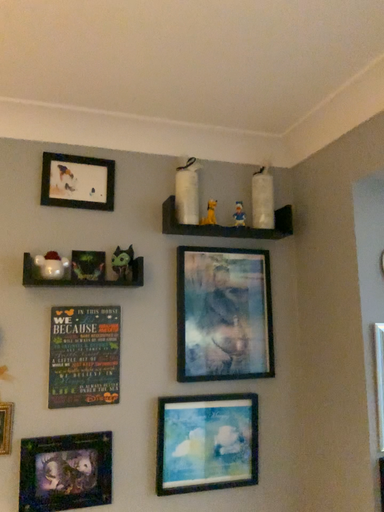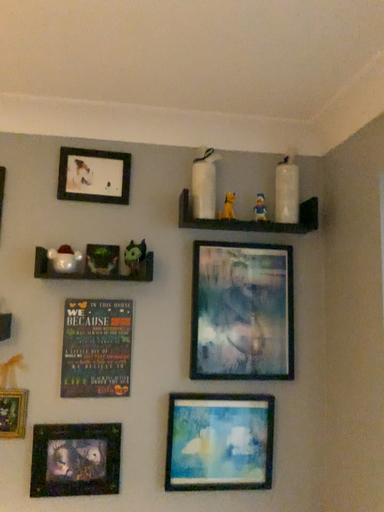
Question: How did the camera likely rotate when shooting the video?

Choices:
 (A) rotated right
 (B) rotated left

Answer: (B)